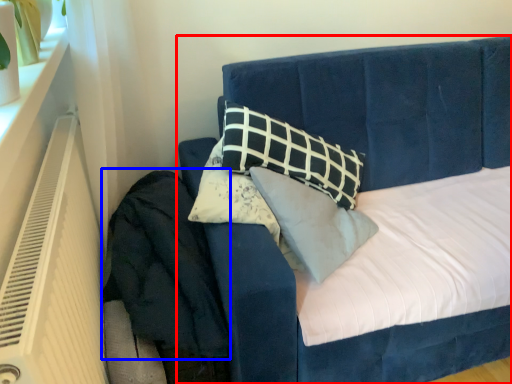
Question: Among these objects, which one is farthest to the camera, bed (highlighted by a red box) or velvet (highlighted by a blue box)?

Choices:
 (A) bed
 (B) velvet

Answer: (B)